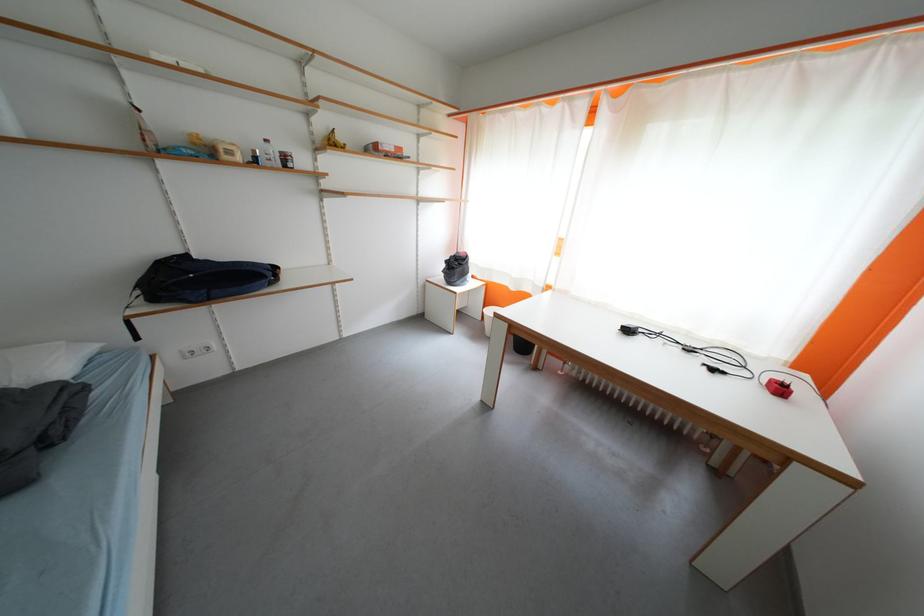
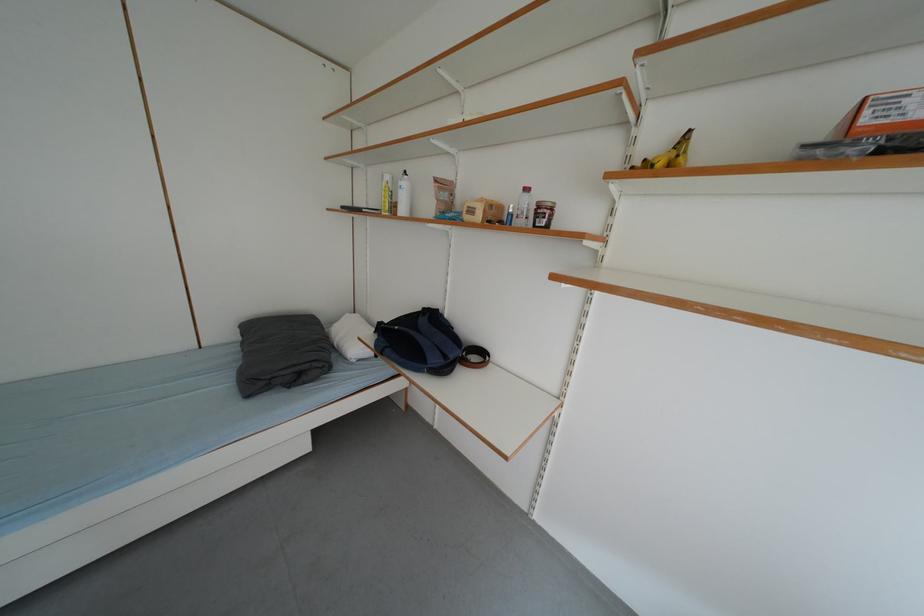
In the second image, find the point that corresponds to point (247, 161) in the first image.

(487, 220)